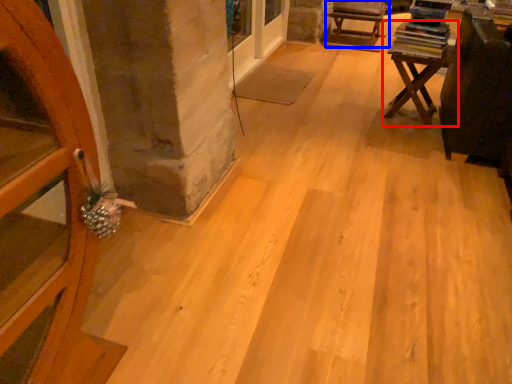
Question: Which point is further to the camera, table (highlighted by a red box) or armchair (highlighted by a blue box)?

Choices:
 (A) table
 (B) armchair

Answer: (B)